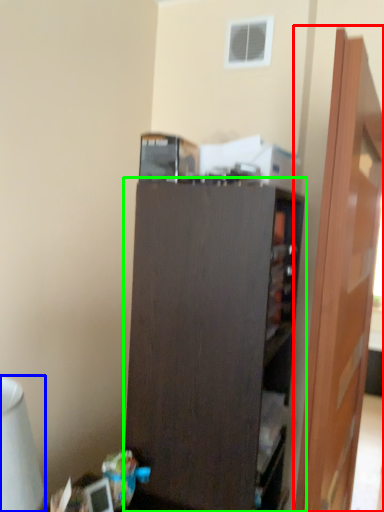
Question: Which object is positioned closest to door (highlighted by a red box)? Select from table lamp (highlighted by a blue box) and cupboard (highlighted by a green box).

Choices:
 (A) table lamp
 (B) cupboard

Answer: (B)